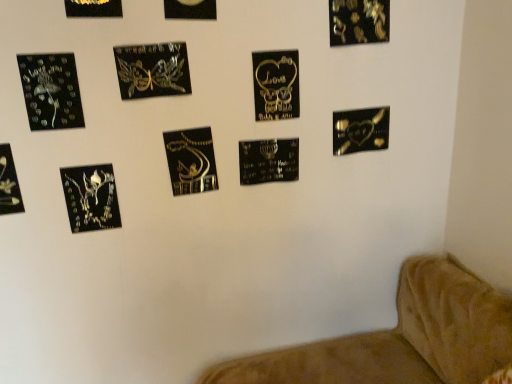
Question: Is metallic gold picture frame at upper left, positioned as the 4th picture frame in left-to-right order, smaller than black metallic plaque at center, positioned as the ninth picture frame in left-to-right order?

Choices:
 (A) yes
 (B) no

Answer: (A)

Question: Is metallic gold picture frame at upper left, marked as the 8th picture frame in a right-to-left arrangement, wider than black metallic plaque at center, placed as the third picture frame when sorted from right to left?

Choices:
 (A) yes
 (B) no

Answer: (B)

Question: Could you tell me if metallic gold picture frame at upper left, positioned as the 4th picture frame in left-to-right order, is turned towards black metallic plaque at center, placed as the third picture frame when sorted from right to left?

Choices:
 (A) yes
 (B) no

Answer: (B)

Question: Is metallic gold picture frame at upper left, marked as the 8th picture frame in a right-to-left arrangement, closer to camera compared to black metallic plaque at center, placed as the third picture frame when sorted from right to left?

Choices:
 (A) yes
 (B) no

Answer: (A)

Question: Can you confirm if metallic gold picture frame at upper left, marked as the 8th picture frame in a right-to-left arrangement, is shorter than black metallic plaque at center, positioned as the ninth picture frame in left-to-right order?

Choices:
 (A) yes
 (B) no

Answer: (A)

Question: From the image's perspective, does metallic gold picture frame at upper left, marked as the 8th picture frame in a right-to-left arrangement, appear higher than black metallic plaque at center, positioned as the ninth picture frame in left-to-right order?

Choices:
 (A) yes
 (B) no

Answer: (A)

Question: Would you say black glossy heart at lower right, placed as the 11th picture frame when sorted from left to right, contains black glossy picture frame at upper center, the seventh picture frame viewed from the left?

Choices:
 (A) yes
 (B) no

Answer: (B)

Question: Is black glossy heart at lower right, placed as the 11th picture frame when sorted from left to right, shorter than black glossy picture frame at upper center, which appears as the fifth picture frame when viewed from the right?

Choices:
 (A) yes
 (B) no

Answer: (A)

Question: Is black glossy picture frame at upper center, which appears as the fifth picture frame when viewed from the right, at the back of black glossy heart at lower right, placed as the 11th picture frame when sorted from left to right?

Choices:
 (A) yes
 (B) no

Answer: (B)

Question: Is black glossy heart at lower right, placed as the 11th picture frame when sorted from left to right, positioned beyond the bounds of black glossy picture frame at upper center, the seventh picture frame viewed from the left?

Choices:
 (A) yes
 (B) no

Answer: (A)

Question: From the image's perspective, is black glossy heart at lower right, which is the 1th picture frame in right-to-left order, below black glossy picture frame at upper center, the seventh picture frame viewed from the left?

Choices:
 (A) yes
 (B) no

Answer: (A)

Question: From a real-world perspective, is black glossy heart at lower right, which is the 1th picture frame in right-to-left order, positioned over black glossy picture frame at upper center, which appears as the fifth picture frame when viewed from the right, based on gravity?

Choices:
 (A) no
 (B) yes

Answer: (A)

Question: Is black glossy heart at lower right, which is the 1th picture frame in right-to-left order, at the left side of metallic gold picture frame at upper left, marked as the 8th picture frame in a right-to-left arrangement?

Choices:
 (A) yes
 (B) no

Answer: (B)